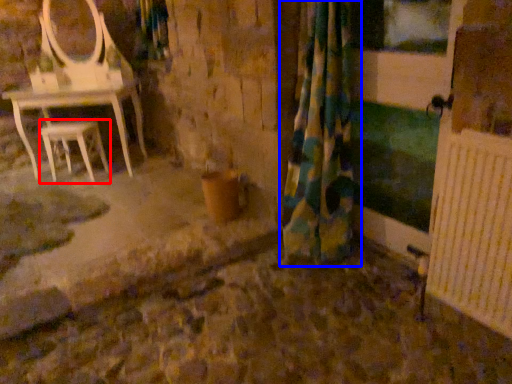
Question: Which of the following is the farthest to the observer, stool (highlighted by a red box) or curtain (highlighted by a blue box)?

Choices:
 (A) stool
 (B) curtain

Answer: (A)